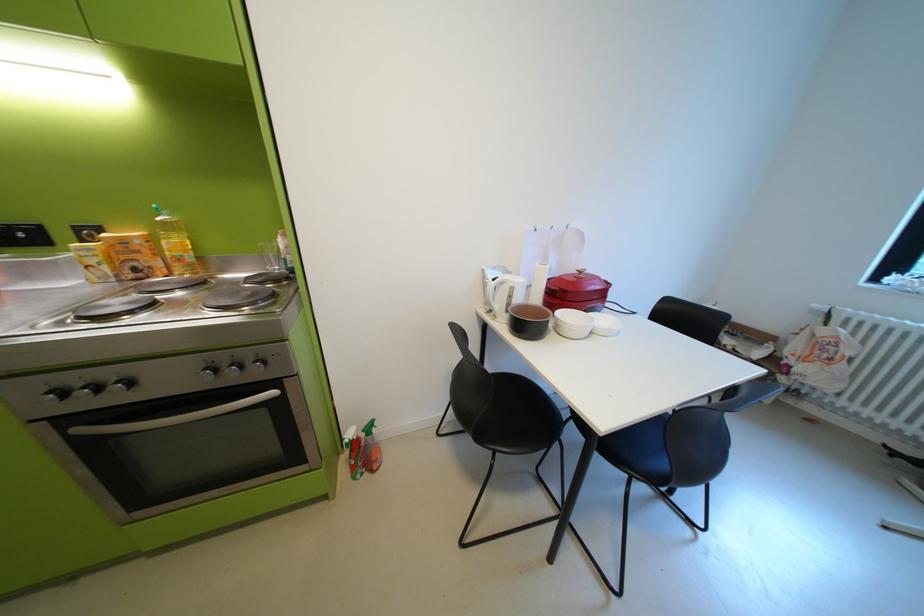
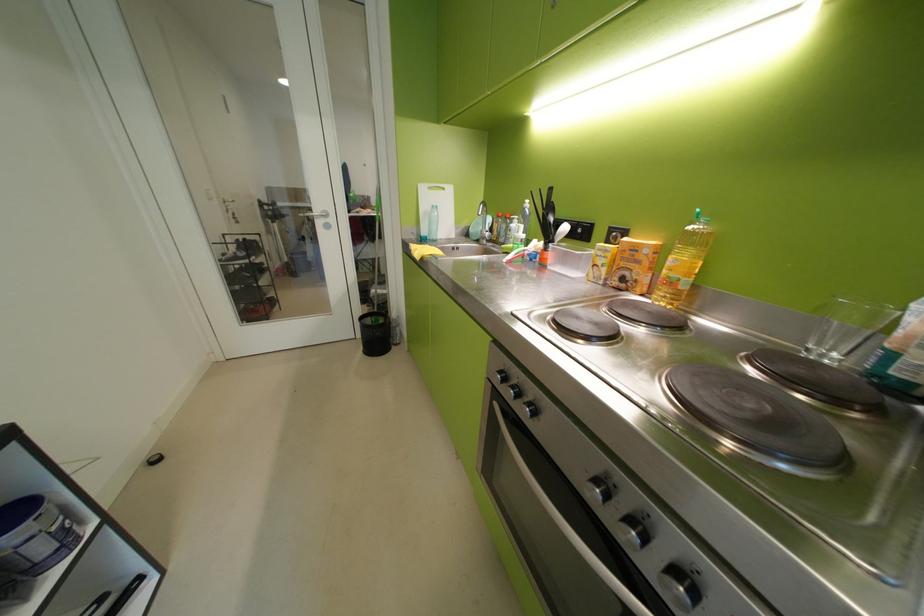
In the second image, find the point that corresponds to [134,243] in the first image.

(646, 249)